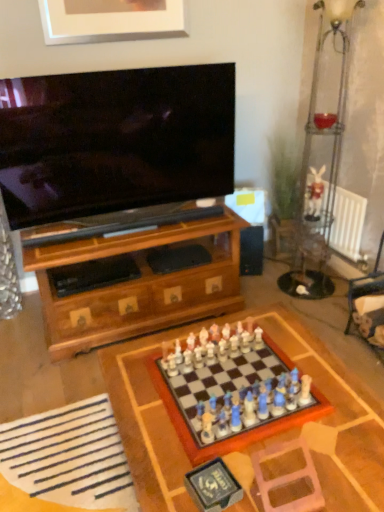
Question: Should I look upward or downward to see pink plastic swivel chair at lower right, the 2th swivel chair when ordered from right to left?

Choices:
 (A) down
 (B) up

Answer: (A)

Question: Is pink plastic swivel chair at lower right, which appears as the second swivel chair when viewed from the back, taller than wooden chess set at center?

Choices:
 (A) no
 (B) yes

Answer: (B)

Question: Does pink plastic swivel chair at lower right, the first swivel chair positioned from the left, lie behind wooden chess set at center?

Choices:
 (A) no
 (B) yes

Answer: (A)

Question: From a real-world perspective, is pink plastic swivel chair at lower right, the 2th swivel chair when ordered from right to left, physically below wooden chess set at center?

Choices:
 (A) yes
 (B) no

Answer: (B)

Question: Is pink plastic swivel chair at lower right, which appears as the second swivel chair when viewed from the back, in contact with wooden chess set at center?

Choices:
 (A) yes
 (B) no

Answer: (B)

Question: From the image's perspective, is pink plastic swivel chair at lower right, positioned as the first swivel chair in front-to-back order, located above wooden chess set at center?

Choices:
 (A) no
 (B) yes

Answer: (A)

Question: Considering the relative sizes of pink plastic swivel chair at lower right, the first swivel chair positioned from the left, and wooden chess set at center in the image provided, is pink plastic swivel chair at lower right, the first swivel chair positioned from the left, bigger than wooden chess set at center?

Choices:
 (A) no
 (B) yes

Answer: (A)

Question: From a real-world perspective, is white metallic radiator at right over pink plastic swivel chair at lower right, which ranks as the 2th swivel chair in top-to-bottom order?

Choices:
 (A) no
 (B) yes

Answer: (A)

Question: Does white metallic radiator at right have a lesser width compared to pink plastic swivel chair at lower right, the first swivel chair positioned from the left?

Choices:
 (A) yes
 (B) no

Answer: (A)

Question: Is white metallic radiator at right facing away from pink plastic swivel chair at lower right, which ranks as the first swivel chair in bottom-to-top order?

Choices:
 (A) no
 (B) yes

Answer: (A)

Question: Considering the relative sizes of white metallic radiator at right and pink plastic swivel chair at lower right, which ranks as the 2th swivel chair in top-to-bottom order, in the image provided, is white metallic radiator at right taller than pink plastic swivel chair at lower right, which ranks as the 2th swivel chair in top-to-bottom order,?

Choices:
 (A) no
 (B) yes

Answer: (B)

Question: Is white metallic radiator at right at the left side of pink plastic swivel chair at lower right, which appears as the second swivel chair when viewed from the back?

Choices:
 (A) yes
 (B) no

Answer: (B)

Question: Considering the relative sizes of white metallic radiator at right and pink plastic swivel chair at lower right, the first swivel chair positioned from the left, in the image provided, is white metallic radiator at right bigger than pink plastic swivel chair at lower right, the first swivel chair positioned from the left,?

Choices:
 (A) no
 (B) yes

Answer: (B)

Question: Does brushed silver picture frame at upper center have a lesser width compared to wooden chessboard at center?

Choices:
 (A) no
 (B) yes

Answer: (B)